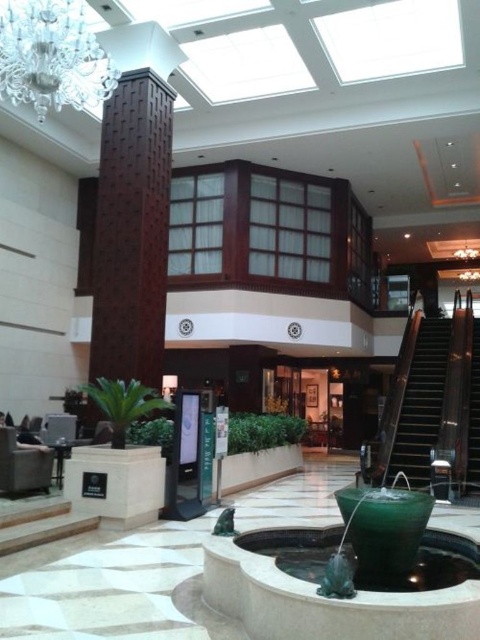
Question: Which object appears closest to the camera in this image?

Choices:
 (A) green marble fountain at center
 (B) green glass bowl at center
 (C) brown wooden stairs at right

Answer: (A)

Question: Considering the relative positions of green marble fountain at center and brown wooden stairs at right in the image provided, where is green marble fountain at center located with respect to brown wooden stairs at right?

Choices:
 (A) right
 (B) left

Answer: (B)

Question: Among these points, which one is nearest to the camera?

Choices:
 (A) (64, 44)
 (B) (471, 346)
 (C) (446, 330)

Answer: (A)

Question: Which of the following is the farthest from the observer?

Choices:
 (A) (3, 52)
 (B) (254, 563)
 (C) (474, 365)
 (D) (423, 509)

Answer: (C)

Question: Does green glass bowl at center have a greater width compared to metallic staircase at right?

Choices:
 (A) no
 (B) yes

Answer: (A)

Question: Is crystal glass chandelier at upper left in front of green glass bowl at center?

Choices:
 (A) no
 (B) yes

Answer: (A)